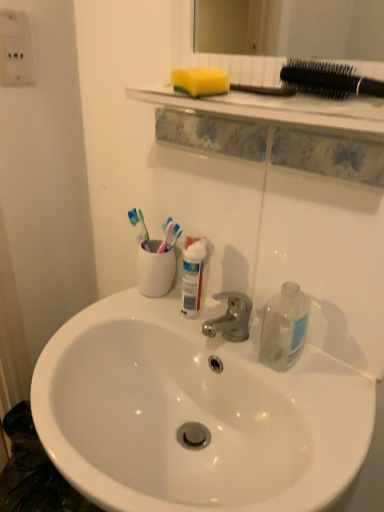
I want to click on yellow sponge at upper center, so click(x=200, y=81).

Locate an element on the screen. The width and height of the screenshot is (384, 512). white glossy sink at center is located at coordinates (194, 413).

Measure the distance between point [200,284] and camera.

Point [200,284] and camera are 32.17 inches apart.

The image size is (384, 512). Describe the element at coordinates (16, 50) in the screenshot. I see `white plastic electric outlet at upper left` at that location.

Identify the location of white plastic electric outlet at upper left. Image resolution: width=384 pixels, height=512 pixels. pos(16,50).

The height and width of the screenshot is (512, 384). In order to click on transparent glass bottle at right in this screenshot , I will do `click(284, 327)`.

Find the location of `yellow sponge at upper center`. yellow sponge at upper center is located at coordinates 200,81.

Is white glossy sink at center at the right side of black plastic hairbrush at upper right?

No, white glossy sink at center is not to the right of black plastic hairbrush at upper right.

Is point (135, 311) positioned after point (365, 86)?

Yes, it is behind point (365, 86).

From a real-world perspective, who is located lower, white glossy sink at center or black plastic hairbrush at upper right?

In real-world perspective, white glossy sink at center is lower.

Does white glossy tube at center have a lesser height compared to white plastic electric outlet at upper left?

No.

From a real-world perspective, which is physically above, white glossy tube at center or white plastic electric outlet at upper left?

white plastic electric outlet at upper left, from a real-world perspective.

From the image's perspective, is white glossy tube at center on white plastic electric outlet at upper left?

No, from the image's perspective, white glossy tube at center is not above white plastic electric outlet at upper left.

Would you say white glossy sink at center is a long distance from yellow sponge at upper center?

Actually, white glossy sink at center and yellow sponge at upper center are a little close together.

Which of these two, white glossy sink at center or yellow sponge at upper center, is smaller?

yellow sponge at upper center.

Looking at this image, considering the relative sizes of white glossy sink at center and yellow sponge at upper center in the image provided, is white glossy sink at center wider than yellow sponge at upper center?

Yes.

Looking at this image, relative to yellow sponge at upper center, is white glossy sink at center in front or behind?

In the image, white glossy sink at center appears in front of yellow sponge at upper center.

Is black plastic hairbrush at upper right positioned with its back to white glossy sink at center?

No, black plastic hairbrush at upper right's orientation is not away from white glossy sink at center.

From a real-world perspective, who is located lower, black plastic hairbrush at upper right or white glossy sink at center?

white glossy sink at center.

Between black plastic hairbrush at upper right and white glossy sink at center, which one has larger size?

white glossy sink at center is bigger.

Consider the image. Considering the relative positions of black plastic hairbrush at upper right and white glossy sink at center in the image provided, is black plastic hairbrush at upper right behind white glossy sink at center?

That is True.

Relative to white glossy sink at center, is transparent glass bottle at right in front or behind?

Visually, transparent glass bottle at right is located behind white glossy sink at center.

From a real-world perspective, is transparent glass bottle at right positioned above or below white glossy sink at center?

transparent glass bottle at right is above white glossy sink at center.

This screenshot has height=512, width=384. I want to click on cleaning product located on the right of white glossy sink at center, so click(284, 327).

Is transparent glass bottle at right taller or shorter than white glossy sink at center?

In the image, transparent glass bottle at right appears to be shorter than white glossy sink at center.

Which of these two, yellow sponge at upper center or white plastic electric outlet at upper left, is thinner?

With smaller width is white plastic electric outlet at upper left.

Identify the location of soap below the white plastic electric outlet at upper left (from a real-world perspective). (200, 81).

Does point (206, 82) lie in front of point (12, 42)?

That is True.

From the image's perspective, is transparent glass bottle at right located above yellow sponge at upper center?

No, from the image's perspective, transparent glass bottle at right is not on top of yellow sponge at upper center.

Choose the correct answer: Is transparent glass bottle at right inside yellow sponge at upper center or outside it?

transparent glass bottle at right cannot be found inside yellow sponge at upper center.

Is transparent glass bottle at right further to the viewer compared to yellow sponge at upper center?

Yes, it is.

Considering the relative positions of transparent glass bottle at right and yellow sponge at upper center in the image provided, is transparent glass bottle at right to the left or to the right of yellow sponge at upper center?

transparent glass bottle at right is positioned on yellow sponge at upper center's right side.

Locate an element on the screen. brush lying above the white glossy sink at center (from the image's perspective) is located at coordinates (328, 80).

The image size is (384, 512). I want to click on toiletry below the white plastic electric outlet at upper left (from the image's perspective), so click(x=192, y=274).

From the picture: Which object lies nearer to the anchor point white glossy sink at center, black plastic hairbrush at upper right or transparent glass bottle at right?

Among the two, transparent glass bottle at right is located nearer to white glossy sink at center.

Based on their spatial positions, is black plastic hairbrush at upper right or yellow sponge at upper center further from white glossy tube at center?

Based on the image, black plastic hairbrush at upper right appears to be further to white glossy tube at center.

From the image, which object appears to be farther from white plastic electric outlet at upper left, yellow sponge at upper center or white glossy sink at center?

Based on the image, white glossy sink at center appears to be further to white plastic electric outlet at upper left.

Estimate the real-world distances between objects in this image. Which object is closer to transparent glass bottle at right, white glossy sink at center or yellow sponge at upper center?

Based on the image, white glossy sink at center appears to be nearer to transparent glass bottle at right.

Considering their positions, is yellow sponge at upper center positioned further to white plastic electric outlet at upper left than transparent glass bottle at right?

Based on the image, transparent glass bottle at right appears to be further to white plastic electric outlet at upper left.

Based on the photo, based on their spatial positions, is white glossy tube at center or transparent glass bottle at right closer to white glossy sink at center?

transparent glass bottle at right is positioned closer to the anchor white glossy sink at center.

Considering their positions, is white plastic electric outlet at upper left positioned closer to transparent glass bottle at right than yellow sponge at upper center?

yellow sponge at upper center is closer to transparent glass bottle at right.

Looking at the image, which one is located closer to black plastic hairbrush at upper right, white glossy sink at center or yellow sponge at upper center?

Based on the image, yellow sponge at upper center appears to be nearer to black plastic hairbrush at upper right.

Locate an element on the screen. The height and width of the screenshot is (512, 384). toiletry that lies between white plastic electric outlet at upper left and white glossy sink at center from top to bottom is located at coordinates (192, 274).

Where is `toiletry between yellow sponge at upper center and transparent glass bottle at right vertically`? The width and height of the screenshot is (384, 512). toiletry between yellow sponge at upper center and transparent glass bottle at right vertically is located at coordinates (192, 274).

Identify the location of soap between white plastic electric outlet at upper left and white glossy tube at center in the up-down direction. The width and height of the screenshot is (384, 512). (200, 81).

The width and height of the screenshot is (384, 512). Identify the location of toiletry between black plastic hairbrush at upper right and white glossy sink at center in the vertical direction. (192, 274).